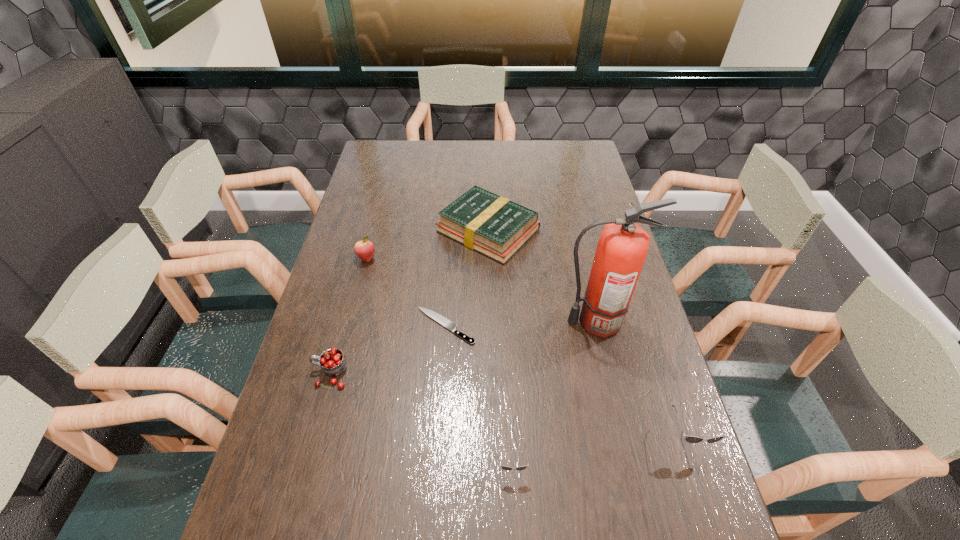
Locate an element on the screen. The image size is (960, 540). vacant region located 0.050m on the left of the third shortest object is located at coordinates (421, 230).

Locate an element on the screen. vacant space situated on the back of the shortest object is located at coordinates (448, 282).

Where is `free space located on the front of the apple`? free space located on the front of the apple is located at coordinates (350, 323).

This screenshot has height=540, width=960. Find the location of `free space located 0.390m on the nozzle of the tallest object`. free space located 0.390m on the nozzle of the tallest object is located at coordinates [420, 322].

The image size is (960, 540). In order to click on free spot located 0.130m on the nozzle of the tallest object in this screenshot , I will do `click(513, 322)`.

Locate an element on the screen. This screenshot has width=960, height=540. vacant space located on the nozzle of the tallest object is located at coordinates (420, 322).

At what (x,y) coordinates should I click in order to perform the action: click on object present at the near edge. Please return your answer as a coordinate pair (x, y). The width and height of the screenshot is (960, 540). Looking at the image, I should click on (503, 467).

At what (x,y) coordinates should I click in order to perform the action: click on apple located at the left edge. Please return your answer as a coordinate pair (x, y). Looking at the image, I should click on (364, 249).

Locate an element on the screen. cherry at the left edge is located at coordinates tap(332, 361).

Where is `sunglasses that is positioned at the right edge`? The image size is (960, 540). sunglasses that is positioned at the right edge is located at coordinates (691, 439).